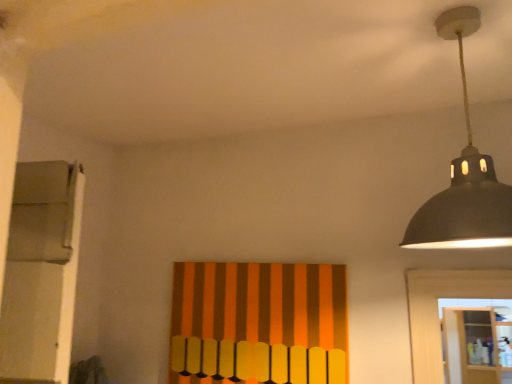
Where is `matte black lampshade at upper right`? matte black lampshade at upper right is located at coordinates (464, 177).

Identify the location of orange striped fabric at center. (258, 323).

Find the location of a particular element. wooden cabinet at lower right is located at coordinates (476, 345).

You are a GUI agent. You are given a task and a screenshot of the screen. Output one action in this format:
    pyautogui.click(x=<x>, y=<y>)
    Task: Click on the matte black lampshade at upper right
    
    Given the screenshot: What is the action you would take?
    pyautogui.click(x=464, y=177)

Between wooden cabinet at lower right and matte black lampshade at upper right, which one has larger width?

matte black lampshade at upper right.

From the picture: In terms of height, does wooden cabinet at lower right look taller or shorter compared to matte black lampshade at upper right?

wooden cabinet at lower right is taller than matte black lampshade at upper right.

Which point is more distant from viewer, (449, 366) or (431, 232)?

The point (449, 366) is more distant.

How many degrees apart are the facing directions of wooden cabinet at lower right and matte black lampshade at upper right?

The angle between the facing direction of wooden cabinet at lower right and the facing direction of matte black lampshade at upper right is 178 degrees.

From the image's perspective, is matte black lampshade at upper right below orange striped fabric at center?

No, from the image's perspective, matte black lampshade at upper right is not below orange striped fabric at center.

From a real-world perspective, between matte black lampshade at upper right and orange striped fabric at center, who is vertically lower?

In real-world perspective, orange striped fabric at center is lower.

Considering the relative sizes of matte black lampshade at upper right and orange striped fabric at center in the image provided, is matte black lampshade at upper right bigger than orange striped fabric at center?

Yes, matte black lampshade at upper right is bigger than orange striped fabric at center.

What's the angular difference between matte black lampshade at upper right and orange striped fabric at center's facing directions?

177 degrees.

Find the location of `shelf on the right of matte black lampshade at upper right`. shelf on the right of matte black lampshade at upper right is located at coordinates (476, 345).

Is wooden cabinet at lower right at the back of matte black lampshade at upper right?

No, wooden cabinet at lower right is not at the back of matte black lampshade at upper right.

Is the depth of matte black lampshade at upper right less than that of wooden cabinet at lower right?

That is True.

Looking at their sizes, would you say orange striped fabric at center is wider or thinner than matte black lampshade at upper right?

orange striped fabric at center is thinner than matte black lampshade at upper right.

From the image's perspective, is orange striped fabric at center over matte black lampshade at upper right?

Incorrect, from the image's perspective, orange striped fabric at center is lower than matte black lampshade at upper right.

How many degrees apart are the facing directions of orange striped fabric at center and matte black lampshade at upper right?

orange striped fabric at center and matte black lampshade at upper right are facing 177 degrees away from each other.

Is wooden cabinet at lower right located within orange striped fabric at center?

No, orange striped fabric at center does not contain wooden cabinet at lower right.

Considering the relative sizes of orange striped fabric at center and wooden cabinet at lower right in the image provided, is orange striped fabric at center thinner than wooden cabinet at lower right?

Indeed, orange striped fabric at center has a lesser width compared to wooden cabinet at lower right.

How different are the orientations of orange striped fabric at center and wooden cabinet at lower right in degrees?

0.609 degrees.

Which of these two, wooden cabinet at lower right or orange striped fabric at center, is smaller?

orange striped fabric at center.

From the image's perspective, is wooden cabinet at lower right above or below orange striped fabric at center?

From the image's perspective, wooden cabinet at lower right appears below orange striped fabric at center.

From a real-world perspective, which is physically below, wooden cabinet at lower right or orange striped fabric at center?

In real-world perspective, wooden cabinet at lower right is lower.

Which object is wider, wooden cabinet at lower right or orange striped fabric at center?

wooden cabinet at lower right.

At what (x,y) coordinates should I click in order to perform the action: click on shelf behind the matte black lampshade at upper right. Please return your answer as a coordinate pair (x, y). This screenshot has height=384, width=512. Looking at the image, I should click on (476, 345).

Where is `curtain below the matte black lampshade at upper right (from a real-world perspective)`? This screenshot has height=384, width=512. curtain below the matte black lampshade at upper right (from a real-world perspective) is located at coordinates (258, 323).

From the image, which object appears to be nearer to matte black lampshade at upper right, wooden cabinet at lower right or orange striped fabric at center?

orange striped fabric at center is closer to matte black lampshade at upper right.

Based on their spatial positions, is matte black lampshade at upper right or wooden cabinet at lower right further from orange striped fabric at center?

The object further to orange striped fabric at center is wooden cabinet at lower right.

Based on their spatial positions, is wooden cabinet at lower right or matte black lampshade at upper right further from orange striped fabric at center?

The object further to orange striped fabric at center is wooden cabinet at lower right.

From the image, which object appears to be farther from matte black lampshade at upper right, orange striped fabric at center or wooden cabinet at lower right?

The object further to matte black lampshade at upper right is wooden cabinet at lower right.

Looking at the image, which one is located closer to wooden cabinet at lower right, orange striped fabric at center or matte black lampshade at upper right?

orange striped fabric at center.

Based on their spatial positions, is matte black lampshade at upper right or orange striped fabric at center closer to wooden cabinet at lower right?

Among the two, orange striped fabric at center is located nearer to wooden cabinet at lower right.

Where is `curtain between matte black lampshade at upper right and wooden cabinet at lower right in the front-back direction`? The width and height of the screenshot is (512, 384). curtain between matte black lampshade at upper right and wooden cabinet at lower right in the front-back direction is located at coordinates (258, 323).